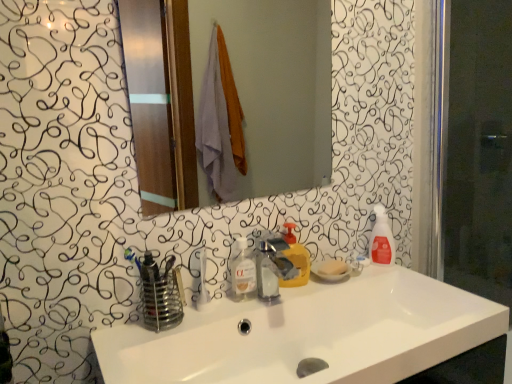
Describe the element at coordinates (243, 268) in the screenshot. I see `clear liquid soap at center` at that location.

Where is `yellow liquid soap at center, positioned as the second cleaning product in right-to-left order`? The image size is (512, 384). yellow liquid soap at center, positioned as the second cleaning product in right-to-left order is located at coordinates (296, 259).

At what (x,y) coordinates should I click in order to perform the action: click on transparent glass screen door at right. Please return your answer as a coordinate pair (x, y). This screenshot has height=384, width=512. Looking at the image, I should click on (477, 146).

Find the location of a particular element. The image size is (512, 384). metallic silver faucet at center is located at coordinates (272, 267).

You are a GUI agent. You are given a task and a screenshot of the screen. Output one action in this format:
    pyautogui.click(x=<x>, y=<y>)
    Task: Click on the translucent plastic spray bottle at right, acting as the 1th cleaning product starting from the right
    This screenshot has height=384, width=512.
    Given the screenshot: What is the action you would take?
    pyautogui.click(x=381, y=239)

What is the approximate height of white glossy sink at center?

It is 4.67 inches.

You are a GUI agent. You are given a task and a screenshot of the screen. Output one action in this format:
    pyautogui.click(x=<x>, y=<y>)
    Task: Click on the clear liquid soap at center
    
    Given the screenshot: What is the action you would take?
    pyautogui.click(x=243, y=268)

Considering the sizes of objects white glossy mirror at upper center and metallic silver faucet at center in the image provided, who is bigger, white glossy mirror at upper center or metallic silver faucet at center?

white glossy mirror at upper center.

Can you see white glossy mirror at upper center touching metallic silver faucet at center?

No, white glossy mirror at upper center is not with metallic silver faucet at center.

Considering the sizes of objects white glossy mirror at upper center and metallic silver faucet at center in the image provided, who is wider, white glossy mirror at upper center or metallic silver faucet at center?

Wider between the two is metallic silver faucet at center.

Is point (204, 56) closer or farther from the camera than point (266, 263)?

Point (204, 56) is positioned farther from the camera compared to point (266, 263).

Identify the location of mirror above the clear liquid soap at center (from a real-world perspective). (236, 87).

Is there a large distance between clear liquid soap at center and white glossy mirror at upper center?

Yes, clear liquid soap at center and white glossy mirror at upper center are located far from each other.

Which object is positioned more to the left, clear liquid soap at center or white glossy mirror at upper center?

A: white glossy mirror at upper center is more to the left.

Is white glossy mirror at upper center aimed at yellow liquid soap at center, positioned as the second cleaning product in right-to-left order?

No, white glossy mirror at upper center is not oriented towards yellow liquid soap at center, positioned as the second cleaning product in right-to-left order.

From a real-world perspective, is white glossy mirror at upper center positioned above or below yellow liquid soap at center, which is the first cleaning product from front to back?

white glossy mirror at upper center is above yellow liquid soap at center, which is the first cleaning product from front to back.

Is white glossy mirror at upper center thinner than yellow liquid soap at center, marked as the first cleaning product in a left-to-right arrangement?

Correct, the width of white glossy mirror at upper center is less than that of yellow liquid soap at center, marked as the first cleaning product in a left-to-right arrangement.

Which of these two, clear liquid soap at center or yellow liquid soap at center, positioned as the second cleaning product in right-to-left order, is thinner?

clear liquid soap at center is thinner.

Find the location of a particular element. toiletry on the left side of yellow liquid soap at center, the 2th cleaning product when ordered from back to front is located at coordinates (243, 268).

From the image's perspective, is clear liquid soap at center under yellow liquid soap at center, marked as the first cleaning product in a left-to-right arrangement?

Indeed, from the image's perspective, clear liquid soap at center is shown beneath yellow liquid soap at center, marked as the first cleaning product in a left-to-right arrangement.

Considering the sizes of objects white glossy mirror at upper center and translucent plastic spray bottle at right, arranged as the second cleaning product when viewed from the front, in the image provided, who is bigger, white glossy mirror at upper center or translucent plastic spray bottle at right, arranged as the second cleaning product when viewed from the front,?

white glossy mirror at upper center.

Locate an element on the screen. The width and height of the screenshot is (512, 384). the 1st cleaning product below the white glossy mirror at upper center (from the image's perspective) is located at coordinates (381, 239).

Can you confirm if white glossy mirror at upper center is positioned to the right of translucent plastic spray bottle at right, arranged as the second cleaning product when viewed from the front?

No, white glossy mirror at upper center is not to the right of translucent plastic spray bottle at right, arranged as the second cleaning product when viewed from the front.

Can you confirm if white glossy sink at center is smaller than yellow liquid soap at center, positioned as the second cleaning product in right-to-left order?

Incorrect, white glossy sink at center is not smaller in size than yellow liquid soap at center, positioned as the second cleaning product in right-to-left order.

Based on the photo, from the image's perspective, which is above, white glossy sink at center or yellow liquid soap at center, marked as the first cleaning product in a left-to-right arrangement?

From the image's view, yellow liquid soap at center, marked as the first cleaning product in a left-to-right arrangement, is above.

Does point (178, 346) appear closer or farther from the camera than point (301, 269)?

Point (178, 346).

Considering the relative sizes of yellow liquid soap at center, the 2th cleaning product when ordered from back to front, and white glossy sink at center in the image provided, is yellow liquid soap at center, the 2th cleaning product when ordered from back to front, bigger than white glossy sink at center?

Incorrect, yellow liquid soap at center, the 2th cleaning product when ordered from back to front, is not larger than white glossy sink at center.

Is the depth of yellow liquid soap at center, positioned as the second cleaning product in right-to-left order, less than that of white glossy sink at center?

That is False.

How much distance is there between yellow liquid soap at center, which is the first cleaning product from front to back, and white glossy sink at center?

A distance of 9.10 inches exists between yellow liquid soap at center, which is the first cleaning product from front to back, and white glossy sink at center.

Is point (293, 283) positioned behind point (452, 298)?

Yes, point (293, 283) is farther from viewer.

Where is `tap below the white glossy mirror at upper center (from the image's perspective)`? tap below the white glossy mirror at upper center (from the image's perspective) is located at coordinates (272, 267).

Find the location of a particular element. This screenshot has width=512, height=384. toiletry below the white glossy mirror at upper center (from a real-world perspective) is located at coordinates tap(243, 268).

Estimate the real-world distances between objects in this image. Which object is further from metallic silver faucet at center, white glossy sink at center or white glossy mirror at upper center?

white glossy mirror at upper center is positioned further to the anchor metallic silver faucet at center.

Looking at this image, which object lies nearer to the anchor point clear liquid soap at center, white glossy sink at center or white glossy mirror at upper center?

white glossy sink at center.

Which object lies further to the anchor point translucent plastic spray bottle at right, arranged as the second cleaning product when viewed from the front, white glossy sink at center or metallic silver faucet at center?

white glossy sink at center lies further to translucent plastic spray bottle at right, arranged as the second cleaning product when viewed from the front, than the other object.

When comparing their distances from white glossy mirror at upper center, does transparent glass screen door at right or metallic silver faucet at center seem further?

metallic silver faucet at center lies further to white glossy mirror at upper center than the other object.

From the picture: Which object lies nearer to the anchor point translucent plastic spray bottle at right, acting as the 1th cleaning product starting from the right, white glossy mirror at upper center or yellow liquid soap at center, the 2th cleaning product when ordered from back to front?

yellow liquid soap at center, the 2th cleaning product when ordered from back to front, is closer to translucent plastic spray bottle at right, acting as the 1th cleaning product starting from the right.

Considering their positions, is transparent glass screen door at right positioned further to metallic silver faucet at center than white glossy sink at center?

transparent glass screen door at right lies further to metallic silver faucet at center than the other object.

Estimate the real-world distances between objects in this image. Which object is further from metallic silver faucet at center, transparent glass screen door at right or translucent plastic spray bottle at right, arranged as the second cleaning product when viewed from the front?

transparent glass screen door at right lies further to metallic silver faucet at center than the other object.

Looking at the image, which one is located further to clear liquid soap at center, metallic silver faucet at center or translucent plastic spray bottle at right, arranged as the second cleaning product when viewed from the front?

Based on the image, translucent plastic spray bottle at right, arranged as the second cleaning product when viewed from the front, appears to be further to clear liquid soap at center.

Identify the location of cleaning product located between white glossy mirror at upper center and translucent plastic spray bottle at right, arranged as the second cleaning product when viewed from the front, in the left-right direction. This screenshot has width=512, height=384. (296, 259).

You are a GUI agent. You are given a task and a screenshot of the screen. Output one action in this format:
    pyautogui.click(x=<x>, y=<y>)
    Task: Click on the tap between white glossy sink at center and translucent plastic spray bottle at right, the first cleaning product in the back-to-front sequence, in the front-back direction
    
    Given the screenshot: What is the action you would take?
    pyautogui.click(x=272, y=267)

You are a GUI agent. You are given a task and a screenshot of the screen. Output one action in this format:
    pyautogui.click(x=<x>, y=<y>)
    Task: Click on the tap between white glossy mirror at upper center and white glossy sink at center in the up-down direction
    Image resolution: width=512 pixels, height=384 pixels.
    Given the screenshot: What is the action you would take?
    pyautogui.click(x=272, y=267)

The image size is (512, 384). In order to click on sink between clear liquid soap at center and transparent glass screen door at right in the horizontal direction in this screenshot , I will do `click(310, 334)`.